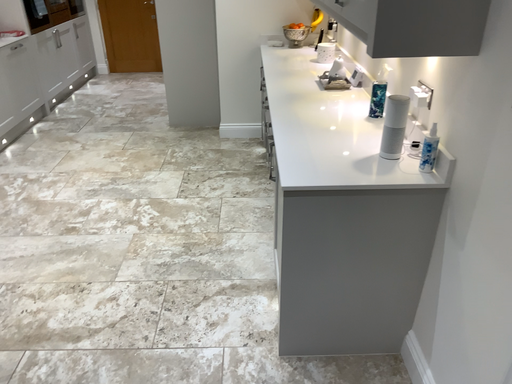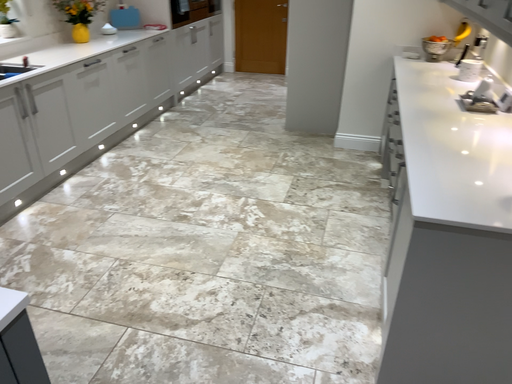
Question: How did the camera likely rotate when shooting the video?

Choices:
 (A) rotated left
 (B) rotated right

Answer: (A)